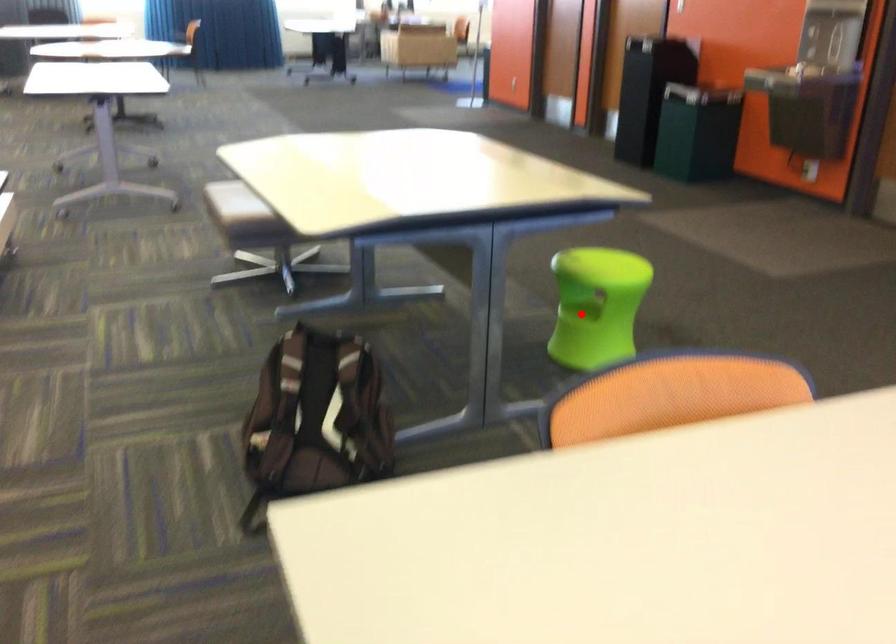
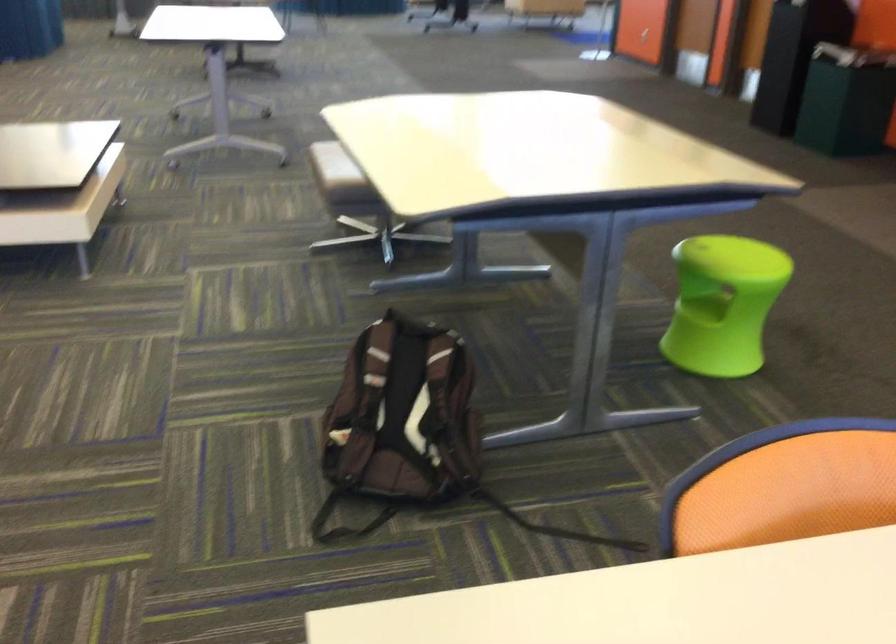
Question: I am providing you with two images of the same scene from different viewpoints. A red point is shown in image1. For the corresponding object point in image2, is it positioned nearer or farther from the camera?

Choices:
 (A) Nearer
 (B) Farther

Answer: (A)